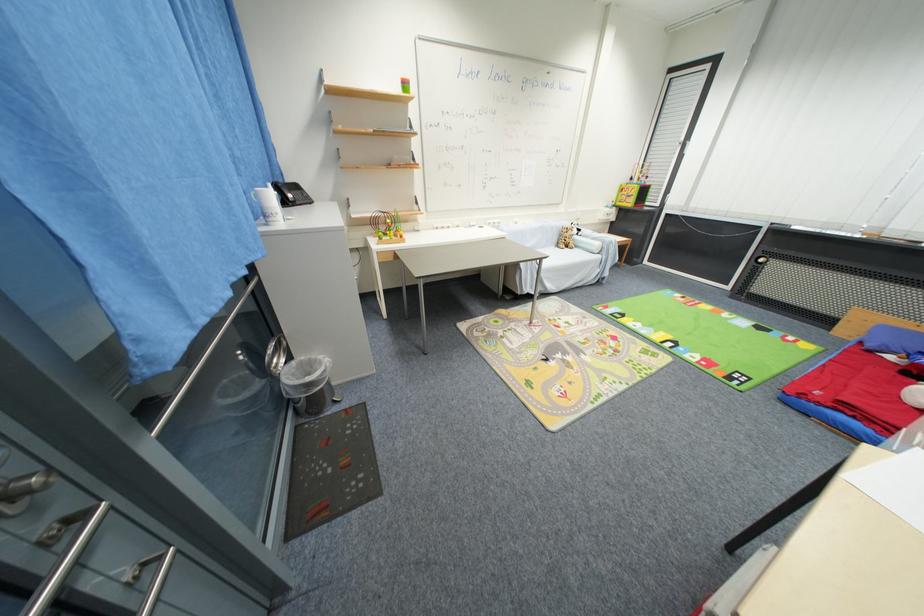
What do you see at coordinates (453, 254) in the screenshot? The image size is (924, 616). I see `a chair sitting surface` at bounding box center [453, 254].